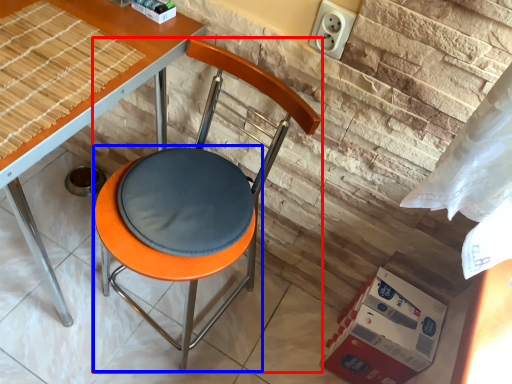
Question: Which object appears closest to the camera in this image, chair (highlighted by a red box) or bar stool (highlighted by a blue box)?

Choices:
 (A) chair
 (B) bar stool

Answer: (A)